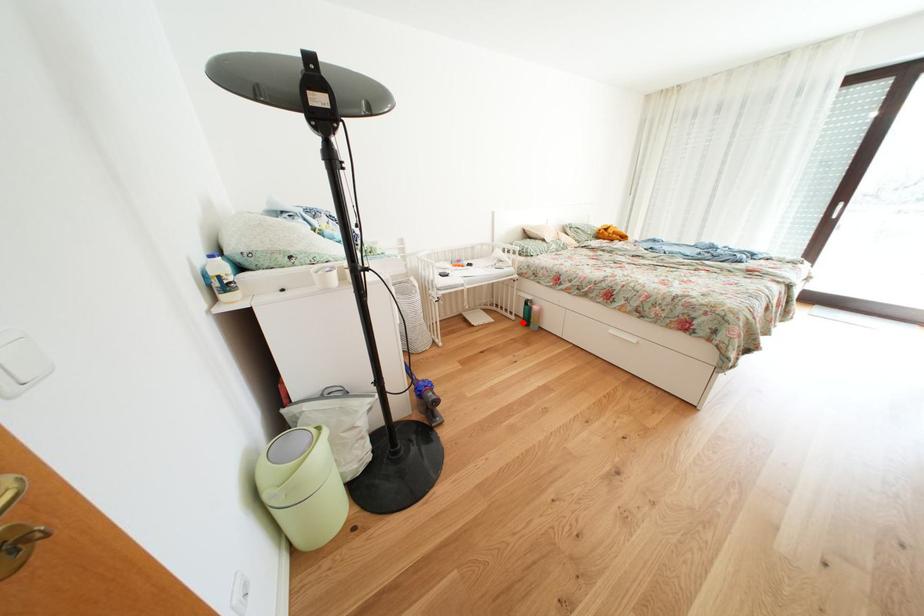
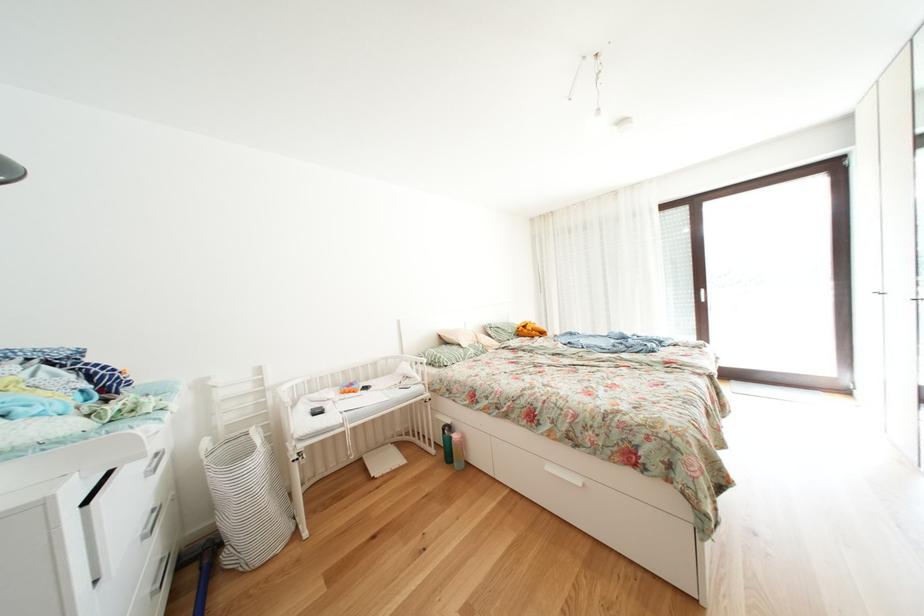
Question: I am providing you with two images of the same scene from different viewpoints. Given a red point in image1, look at the same physical point in image2. Is it:

Choices:
 (A) Closer to the viewpoint
 (B) Farther from the viewpoint

Answer: (B)